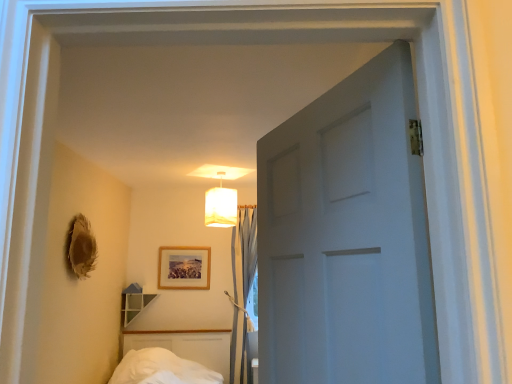
The height and width of the screenshot is (384, 512). Identify the location of free point above white fabric lampshade at upper center (from a real-world perspective). (219, 168).